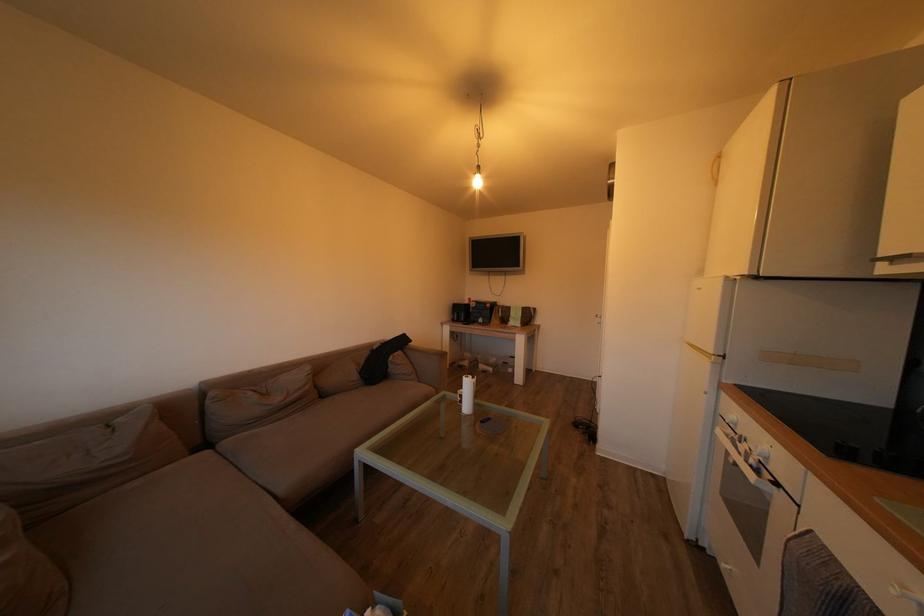
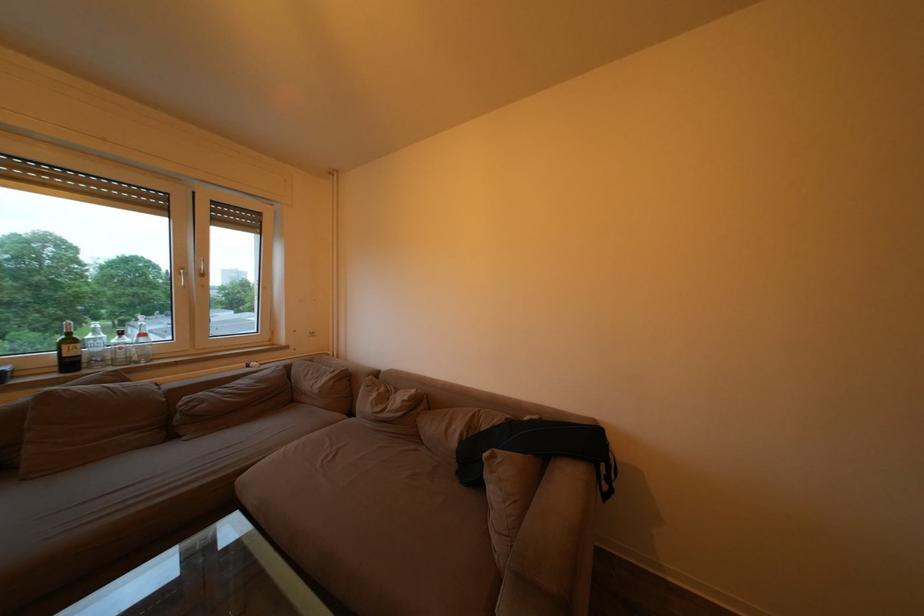
The point at (x=362, y=382) is marked in the first image. Where is the corresponding point in the second image?

(463, 448)